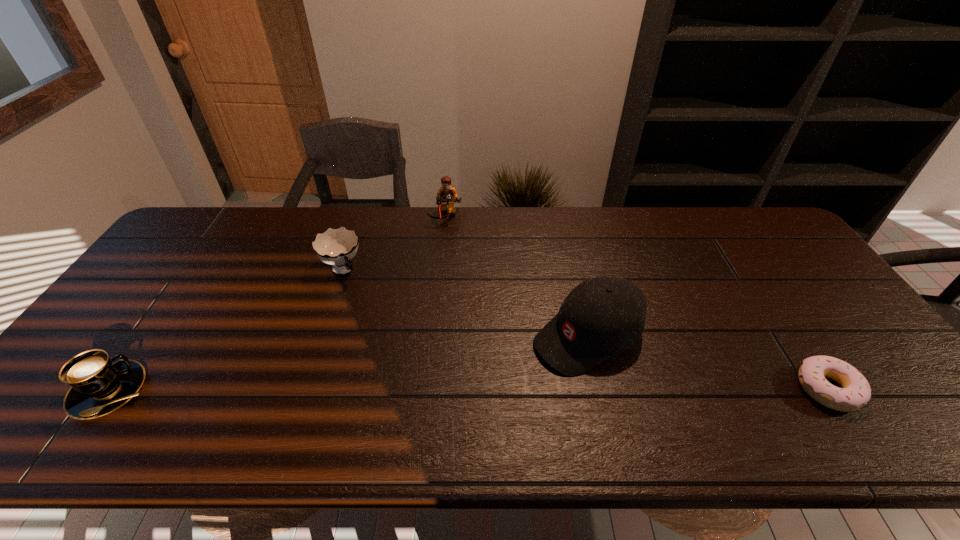
Image resolution: width=960 pixels, height=540 pixels. I want to click on free location at the right edge, so click(x=763, y=274).

I want to click on blank space at the far left corner, so pos(222,211).

In the image, there is a desktop. In order to click on free region at the far right corner in this screenshot , I will do tap(779, 235).

Locate an element on the screen. This screenshot has width=960, height=540. free space between the cappuccino and the shortest object is located at coordinates (469, 390).

At what (x,y) coordinates should I click in order to perform the action: click on empty space that is in between the second farthest object and the second object from right to left. Please return your answer as a coordinate pair (x, y). Looking at the image, I should click on (465, 303).

Where is `free area in between the baseball cap and the Lego`? This screenshot has height=540, width=960. free area in between the baseball cap and the Lego is located at coordinates pyautogui.click(x=516, y=276).

Identify the location of free space between the fourth object from left to right and the shortest object. (708, 363).

The image size is (960, 540). Identify the location of vacant space that is in between the doughnut and the cappuccino. (469, 390).

What are the coordinates of `vacant point located between the baseball cap and the cup` in the screenshot? It's located at (465, 303).

The width and height of the screenshot is (960, 540). What are the coordinates of `free space between the cappuccino and the second farthest object` in the screenshot? It's located at (227, 330).